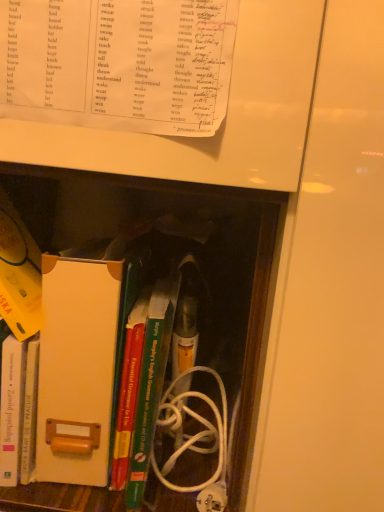
The width and height of the screenshot is (384, 512). What do you see at coordinates (18, 410) in the screenshot?
I see `hardcover book at left, which is the 5th book from top to bottom` at bounding box center [18, 410].

Describe the element at coordinates (150, 386) in the screenshot. I see `green hardcover book at center, the fourth book when ordered from top to bottom` at that location.

Locate an element on the screen. This screenshot has width=384, height=512. green hardcover book at center, which is counted as the second book, starting from the bottom is located at coordinates (150, 386).

You are a GUI agent. You are given a task and a screenshot of the screen. Output one action in this format:
    pyautogui.click(x=<x>, y=<y>)
    Task: Click on the green matte book at center, which appears as the 2th book when viewed from the top
    This screenshot has width=384, height=512.
    Given the screenshot: What is the action you would take?
    pyautogui.click(x=151, y=384)

Describe the element at coordinates (151, 384) in the screenshot. I see `green matte book at center, the 4th book in the bottom-to-top sequence` at that location.

At what (x,y) coordinates should I click in order to perform the action: click on hardcover book at center, which is the third book from bottom to top. Please return your answer as a coordinate pair (x, y). This screenshot has width=384, height=512. Looking at the image, I should click on (129, 389).

In terms of width, does hardcover book at left, acting as the 1th book starting from the bottom, look wider or thinner when compared to green matte book at center, which appears as the 2th book when viewed from the top?

In the image, hardcover book at left, acting as the 1th book starting from the bottom, appears to be more narrow than green matte book at center, which appears as the 2th book when viewed from the top.

Is hardcover book at left, acting as the 1th book starting from the bottom, positioned far away from green matte book at center, which appears as the 2th book when viewed from the top?

Actually, hardcover book at left, acting as the 1th book starting from the bottom, and green matte book at center, which appears as the 2th book when viewed from the top, are a little close together.

Which object is more forward, hardcover book at left, which is the 5th book from top to bottom, or green matte book at center, the 4th book in the bottom-to-top sequence?

green matte book at center, the 4th book in the bottom-to-top sequence, is in front.

Would you say white paper at upper center, the 1th book positioned from the top, is to the left or to the right of hardcover book at left, which is the 5th book from top to bottom, in the picture?

white paper at upper center, the 1th book positioned from the top, is to the right of hardcover book at left, which is the 5th book from top to bottom.

Is white paper at upper center, the 5th book positioned from the bottom, not within hardcover book at left, acting as the 1th book starting from the bottom?

white paper at upper center, the 5th book positioned from the bottom, is positioned outside hardcover book at left, acting as the 1th book starting from the bottom.

What's the angular difference between white paper at upper center, the 1th book positioned from the top, and hardcover book at left, acting as the 1th book starting from the bottom,'s facing directions?

The facing directions of white paper at upper center, the 1th book positioned from the top, and hardcover book at left, acting as the 1th book starting from the bottom, are 3.81 degrees apart.

Measure the distance from white paper at upper center, the 5th book positioned from the bottom, to hardcover book at left, which is the 5th book from top to bottom.

The distance of white paper at upper center, the 5th book positioned from the bottom, from hardcover book at left, which is the 5th book from top to bottom, is 14.11 inches.

Considering the sizes of objects hardcover book at center, which is the third book from bottom to top, and green matte book at center, which appears as the 2th book when viewed from the top, in the image provided, who is wider, hardcover book at center, which is the third book from bottom to top, or green matte book at center, which appears as the 2th book when viewed from the top,?

green matte book at center, which appears as the 2th book when viewed from the top.

Are hardcover book at center, which is the third book from bottom to top, and green matte book at center, which appears as the 2th book when viewed from the top, beside each other?

Yes, hardcover book at center, which is the third book from bottom to top, is with green matte book at center, which appears as the 2th book when viewed from the top.

How distant is hardcover book at center, which is the third book from bottom to top, from green matte book at center, which appears as the 2th book when viewed from the top?

1.49 inches.

Is green hardcover book at center, which is counted as the second book, starting from the bottom, taller or shorter than white cardboard file at center?

In the image, green hardcover book at center, which is counted as the second book, starting from the bottom, appears to be shorter than white cardboard file at center.

Considering the points (170, 281) and (46, 265), which point is in front, point (170, 281) or point (46, 265)?

The point (46, 265) is in front.

Would you say green hardcover book at center, the fourth book when ordered from top to bottom, is outside white cardboard file at center?

Yes, green hardcover book at center, the fourth book when ordered from top to bottom, is located beyond the bounds of white cardboard file at center.

Is white cardboard file at center completely or partially outside of green hardcover book at center, the fourth book when ordered from top to bottom?

That's correct, white cardboard file at center is outside of green hardcover book at center, the fourth book when ordered from top to bottom.

From a real-world perspective, which is physically above, white cardboard file at center or green hardcover book at center, which is counted as the second book, starting from the bottom?

white cardboard file at center is physically above.

From the image's perspective, is white cardboard file at center positioned above or below green hardcover book at center, which is counted as the second book, starting from the bottom?

Based on their image positions, white cardboard file at center is located above green hardcover book at center, which is counted as the second book, starting from the bottom.

From a real-world perspective, count 2nd books downward from the green matte book at center, which appears as the 2th book when viewed from the top, and point to it. Please provide its 2D coordinates.

[(150, 386)]

Is green hardcover book at center, the fourth book when ordered from top to bottom, at the right side of green matte book at center, which appears as the 2th book when viewed from the top?

In fact, green hardcover book at center, the fourth book when ordered from top to bottom, is to the left of green matte book at center, which appears as the 2th book when viewed from the top.

From a real-world perspective, is green hardcover book at center, the fourth book when ordered from top to bottom, under green matte book at center, which appears as the 2th book when viewed from the top?

Yes, from a real-world perspective, green hardcover book at center, the fourth book when ordered from top to bottom, is below green matte book at center, which appears as the 2th book when viewed from the top.

Consider the image. What's the angular difference between green hardcover book at center, which is counted as the second book, starting from the bottom, and green matte book at center, the 4th book in the bottom-to-top sequence,'s facing directions?

green hardcover book at center, which is counted as the second book, starting from the bottom, and green matte book at center, the 4th book in the bottom-to-top sequence, are facing 7.65 degrees away from each other.

Is point (150, 345) more distant than point (81, 358)?

No, it is not.

Is green matte book at center, the 4th book in the bottom-to-top sequence, next to white cardboard file at center?

Yes, green matte book at center, the 4th book in the bottom-to-top sequence, and white cardboard file at center clearly make contact.

In the scene shown: From the image's perspective, is green matte book at center, which appears as the 2th book when viewed from the top, located above or below white cardboard file at center?

Based on their image positions, green matte book at center, which appears as the 2th book when viewed from the top, is located beneath white cardboard file at center.

In terms of height, does green matte book at center, which appears as the 2th book when viewed from the top, look taller or shorter compared to white cardboard file at center?

Clearly, green matte book at center, which appears as the 2th book when viewed from the top, is shorter compared to white cardboard file at center.

Identify the location of book that is the 3rd one below the green matte book at center, the 4th book in the bottom-to-top sequence (from a real-world perspective). Image resolution: width=384 pixels, height=512 pixels. (18, 410).

Locate an element on the screen. This screenshot has height=512, width=384. book that is the 4th one above the hardcover book at left, which is the 5th book from top to bottom (from a real-world perspective) is located at coordinates (118, 63).

Which object lies further to the anchor point white cardboard file at center, green hardcover book at center, the fourth book when ordered from top to bottom, or hardcover book at center, which is the 3th book in top-to-bottom order?

green hardcover book at center, the fourth book when ordered from top to bottom, is positioned further to the anchor white cardboard file at center.

From the image, which object appears to be farther from hardcover book at center, which is the third book from bottom to top, green matte book at center, which appears as the 2th book when viewed from the top, or green hardcover book at center, which is counted as the second book, starting from the bottom?

The object further to hardcover book at center, which is the third book from bottom to top, is green matte book at center, which appears as the 2th book when viewed from the top.

Based on their spatial positions, is green matte book at center, which appears as the 2th book when viewed from the top, or hardcover book at left, acting as the 1th book starting from the bottom, further from white paper at upper center, the 1th book positioned from the top?

Based on the image, hardcover book at left, acting as the 1th book starting from the bottom, appears to be further to white paper at upper center, the 1th book positioned from the top.

Looking at the image, which one is located further to hardcover book at left, acting as the 1th book starting from the bottom, hardcover book at center, which is the 3th book in top-to-bottom order, or green hardcover book at center, the fourth book when ordered from top to bottom?

The object further to hardcover book at left, acting as the 1th book starting from the bottom, is green hardcover book at center, the fourth book when ordered from top to bottom.

Based on their spatial positions, is hardcover book at center, which is the 3th book in top-to-bottom order, or green matte book at center, the 4th book in the bottom-to-top sequence, further from green hardcover book at center, which is counted as the second book, starting from the bottom?

hardcover book at center, which is the 3th book in top-to-bottom order, lies further to green hardcover book at center, which is counted as the second book, starting from the bottom, than the other object.

Looking at the image, which one is located further to hardcover book at center, which is the third book from bottom to top, green hardcover book at center, which is counted as the second book, starting from the bottom, or white cardboard file at center?

The object further to hardcover book at center, which is the third book from bottom to top, is white cardboard file at center.

Looking at the image, which one is located further to hardcover book at center, which is the 3th book in top-to-bottom order, hardcover book at left, which is the 5th book from top to bottom, or green matte book at center, the 4th book in the bottom-to-top sequence?

hardcover book at left, which is the 5th book from top to bottom, is positioned further to the anchor hardcover book at center, which is the 3th book in top-to-bottom order.

When comparing their distances from white cardboard file at center, does white paper at upper center, the 1th book positioned from the top, or hardcover book at center, which is the 3th book in top-to-bottom order, seem closer?

hardcover book at center, which is the 3th book in top-to-bottom order, is positioned closer to the anchor white cardboard file at center.

This screenshot has height=512, width=384. In order to click on paperback book between white paper at upper center, the 1th book positioned from the top, and hardcover book at center, which is the third book from bottom to top, in the up-down direction in this screenshot , I will do `click(77, 369)`.

Where is `paperback book that lies between white paper at upper center, the 5th book positioned from the bottom, and green hardcover book at center, which is counted as the second book, starting from the bottom, from top to bottom`? This screenshot has width=384, height=512. paperback book that lies between white paper at upper center, the 5th book positioned from the bottom, and green hardcover book at center, which is counted as the second book, starting from the bottom, from top to bottom is located at coordinates (77, 369).

Find the location of a particular element. The image size is (384, 512). paperback book situated between hardcover book at left, which is the 5th book from top to bottom, and hardcover book at center, which is the third book from bottom to top, from left to right is located at coordinates tap(77, 369).

You are a GUI agent. You are given a task and a screenshot of the screen. Output one action in this format:
    pyautogui.click(x=<x>, y=<y>)
    Task: Click on the book that lies between white paper at upper center, the 1th book positioned from the top, and hardcover book at center, which is the third book from bottom to top, from top to bottom
    This screenshot has width=384, height=512.
    Given the screenshot: What is the action you would take?
    point(151,384)